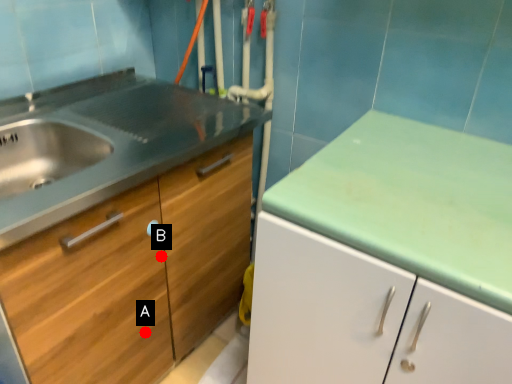
Question: Two points are circled on the image, labeled by A and B beside each circle. Which point is farther from the camera taking this photo?

Choices:
 (A) A is further
 (B) B is further

Answer: (A)